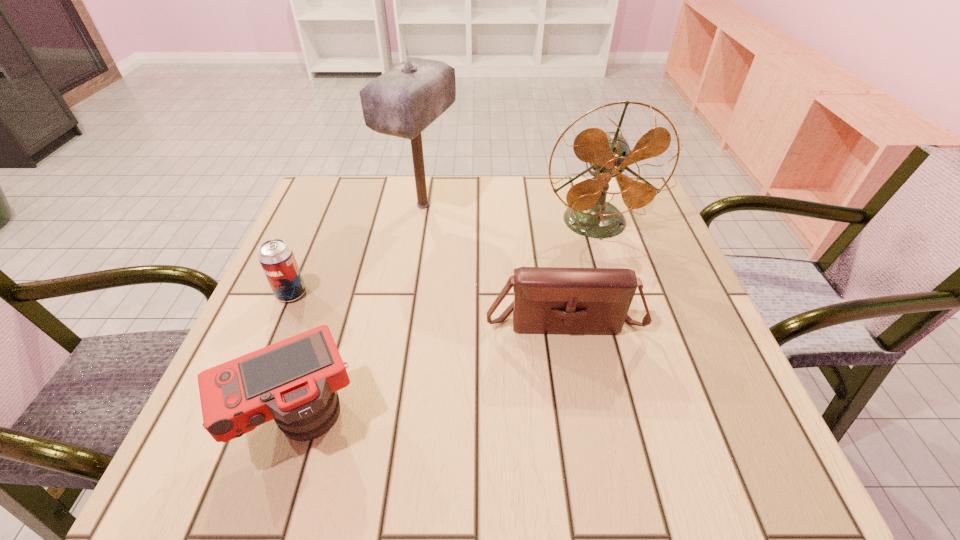
You are a GUI agent. You are given a task and a screenshot of the screen. Output one action in this format:
    pyautogui.click(x=<x>, y=<y>)
    Task: Click on the tallest object
    This screenshot has height=540, width=960.
    Given the screenshot: What is the action you would take?
    pyautogui.click(x=402, y=102)

What are the coordinates of `the fourth shortest object` in the screenshot? It's located at (608, 153).

Image resolution: width=960 pixels, height=540 pixels. Find the location of `shoulder bag`. shoulder bag is located at coordinates (555, 300).

Identify the location of camera. (295, 381).

The width and height of the screenshot is (960, 540). What are the coordinates of `beer can` in the screenshot? It's located at (276, 257).

The image size is (960, 540). I want to click on vacant space located on the front of the mallet, so click(x=413, y=269).

Locate an element on the screen. The height and width of the screenshot is (540, 960). vacant space located 0.140m in front of the fourth shortest object, directing air flow is located at coordinates (615, 286).

Identify the location of free space located 0.210m on the front flap of the shoulder bag. The image size is (960, 540). (587, 447).

Identify the location of free space located 0.370m on the right of the nearest object. (588, 420).

Locate an element on the screen. The height and width of the screenshot is (540, 960). free location located on the right of the beer can is located at coordinates (454, 293).